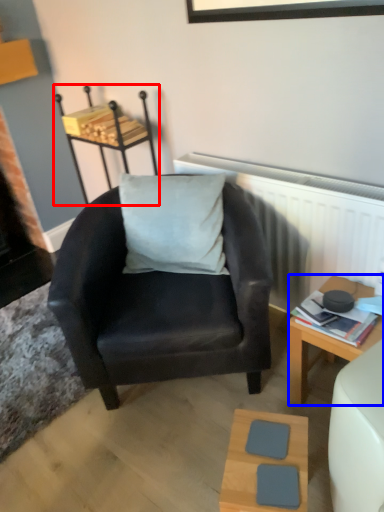
Question: Which point is further to the camera, stool (highlighted by a red box) or desk (highlighted by a blue box)?

Choices:
 (A) stool
 (B) desk

Answer: (A)